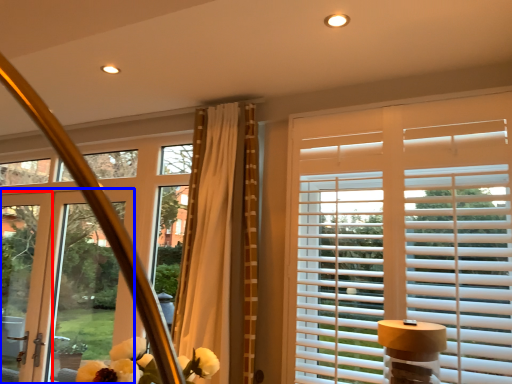
Question: Which point is closer to the camera, screen door (highlighted by a red box) or door (highlighted by a blue box)?

Choices:
 (A) screen door
 (B) door

Answer: (B)